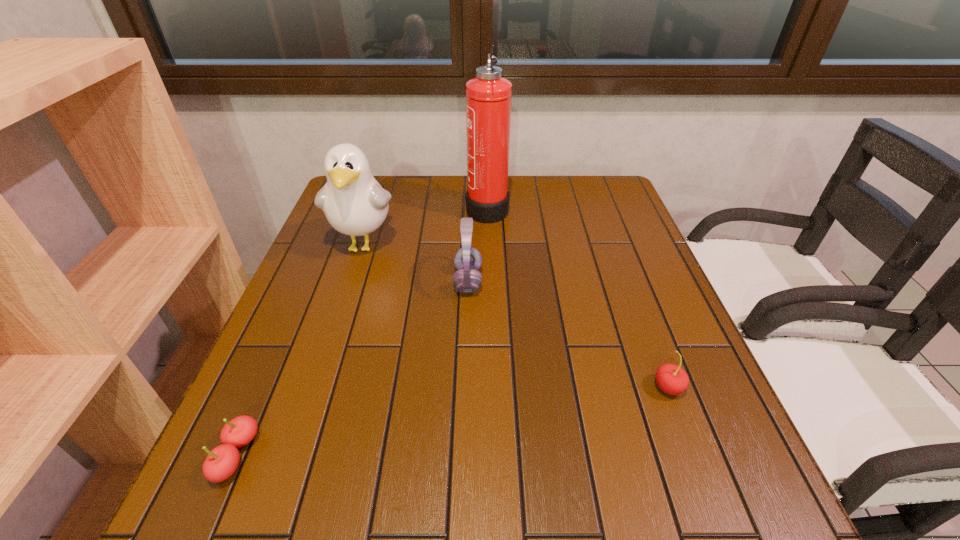
Image resolution: width=960 pixels, height=540 pixels. Identify the location of the tallest object. (488, 96).

The height and width of the screenshot is (540, 960). I want to click on gull, so click(x=355, y=204).

Identify the location of the third tallest object. (467, 260).

Where is `the right cherry`? This screenshot has width=960, height=540. the right cherry is located at coordinates (672, 379).

This screenshot has height=540, width=960. What are the coordinates of `the second shortest object` in the screenshot? It's located at (672, 379).

Identify the location of the shorter cherry. This screenshot has width=960, height=540. (221, 463).

I want to click on the nearer cherry, so click(221, 463).

Identify the location of vacant point located 0.080m on the front-facing side of the fire extinguisher. This screenshot has height=540, width=960. (440, 207).

The image size is (960, 540). I want to click on free location located 0.370m on the front-facing side of the fire extinguisher, so click(344, 207).

Locate an element on the screen. vacant area located on the front-facing side of the fire extinguisher is located at coordinates (364, 207).